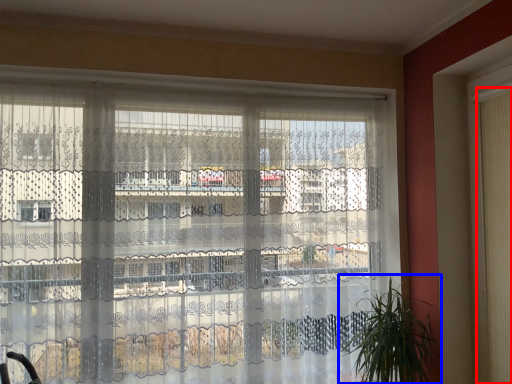
Question: Which point is closer to the camera, shutter (highlighted by a red box) or houseplant (highlighted by a blue box)?

Choices:
 (A) shutter
 (B) houseplant

Answer: (A)